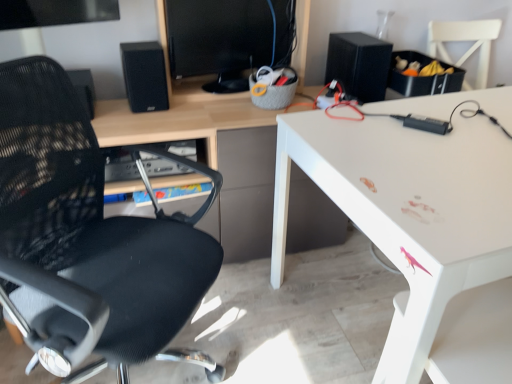
Question: From the image's perspective, relative to white glossy desk at upper right, is black matte speaker at upper left, the 1th speaker positioned from the left, above or below?

Choices:
 (A) below
 (B) above

Answer: (B)

Question: From a real-world perspective, is black matte speaker at upper left, marked as the second speaker in a right-to-left arrangement, physically located above or below white glossy desk at upper right?

Choices:
 (A) above
 (B) below

Answer: (A)

Question: Based on their relative distances, which object is farther from the white glossy desk at upper right?

Choices:
 (A) black matte speaker at upper right, the 1th speaker when ordered from right to left
 (B) black matte speaker at upper left, marked as the second speaker in a right-to-left arrangement
 (C) black mesh chair at left
 (D) black glossy monitor at upper center

Answer: (B)

Question: Which object is the closest to the black matte speaker at upper left, marked as the second speaker in a right-to-left arrangement?

Choices:
 (A) black glossy monitor at upper center
 (B) black mesh chair at left
 (C) black matte speaker at upper right, the second speaker from the left
 (D) white glossy desk at upper right

Answer: (A)